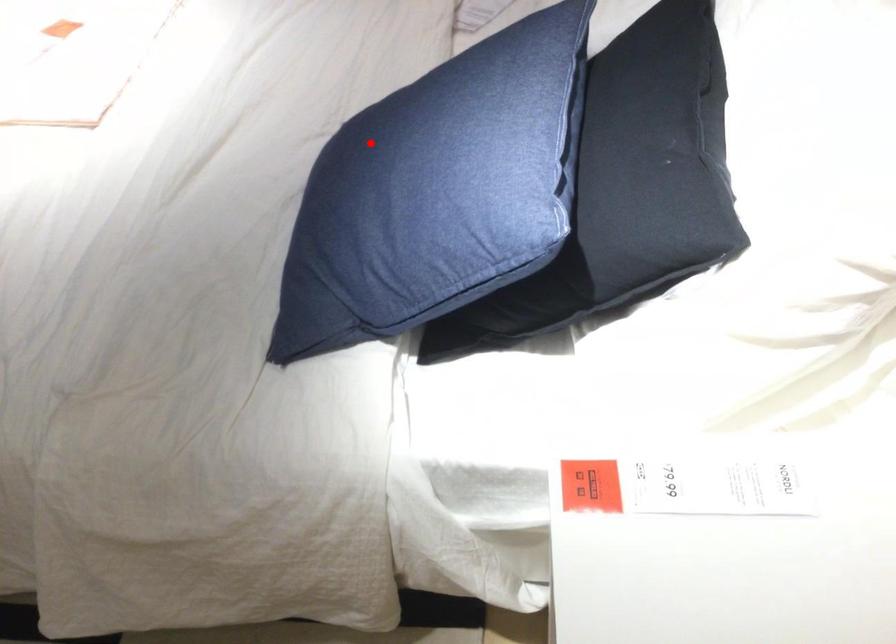
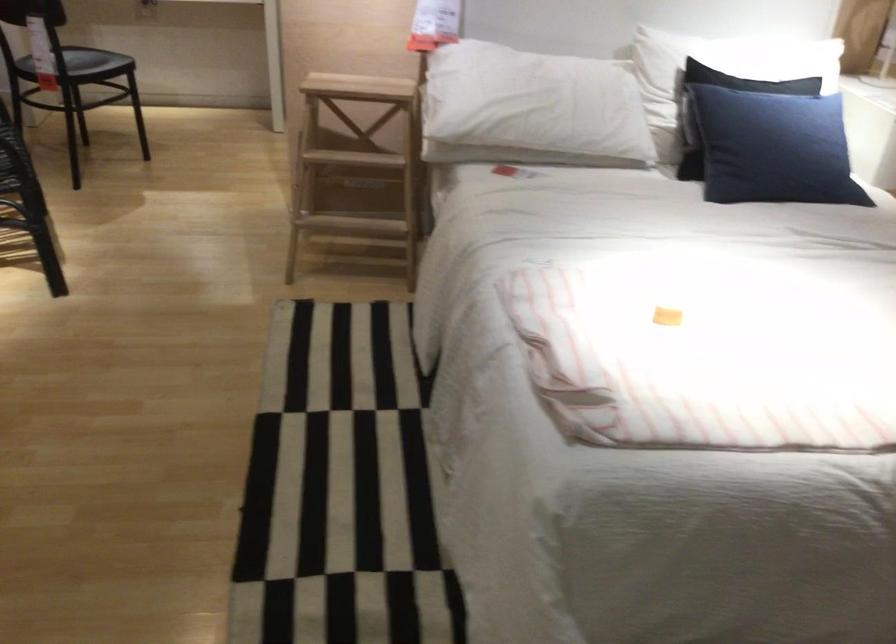
Locate, in the second image, the point that corresponds to the highlighted location in the first image.

(773, 147)